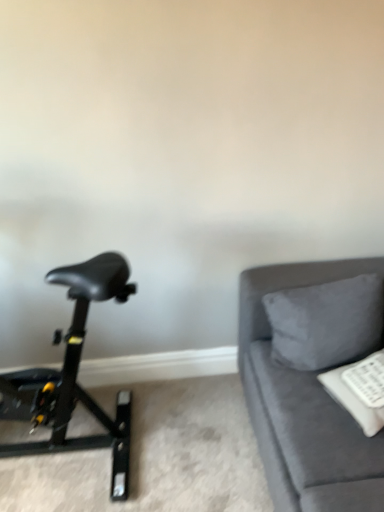
Question: From the image's perspective, relative to suede gray pillow at right, is black matte stationary bicycle at left above or below?

Choices:
 (A) above
 (B) below

Answer: (B)

Question: From a real-world perspective, is black matte stationary bicycle at left positioned above or below suede gray pillow at right?

Choices:
 (A) below
 (B) above

Answer: (B)

Question: Estimate the real-world distances between objects in this image. Which object is closer to the suede gray pillow at right?

Choices:
 (A) black matte stationary bicycle at left
 (B) velvet gray couch at right

Answer: (B)

Question: Estimate the real-world distances between objects in this image. Which object is closer to the velvet gray couch at right?

Choices:
 (A) black matte stationary bicycle at left
 (B) suede gray pillow at right

Answer: (B)